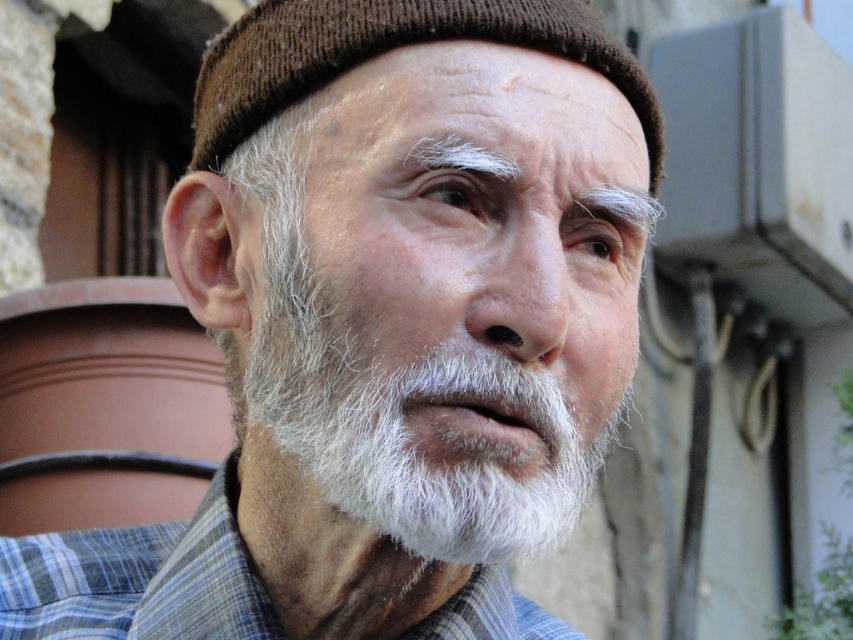
Can you confirm if white matte beard at center is wider than blue plaid shirt at center?

Yes.

Which is in front, point (587, 211) or point (178, 605)?

Positioned in front is point (587, 211).

Which is behind, point (367, 378) or point (82, 568)?

The point (82, 568) is behind.

Locate an element on the screen. white matte beard at center is located at coordinates (416, 364).

Between white matte beard at center and brown knitted hat at upper center, which one appears on the right side from the viewer's perspective?

Positioned to the right is white matte beard at center.

Locate an element on the screen. white matte beard at center is located at coordinates (416, 364).

Between blue plaid shirt at center and brown knitted hat at upper center, which one is positioned higher?

brown knitted hat at upper center is above.

Describe the element at coordinates (138, 579) in the screenshot. I see `blue plaid shirt at center` at that location.

Is point (473, 620) farther from camera compared to point (221, 93)?

Yes, it is behind point (221, 93).

Find the location of `blue plaid shirt at center`. blue plaid shirt at center is located at coordinates (138, 579).